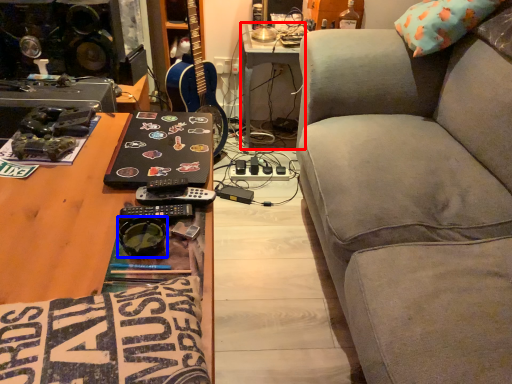
Question: Which of the following is the closest to the observer, table (highlighted by a red box) or goggles (highlighted by a blue box)?

Choices:
 (A) table
 (B) goggles

Answer: (B)